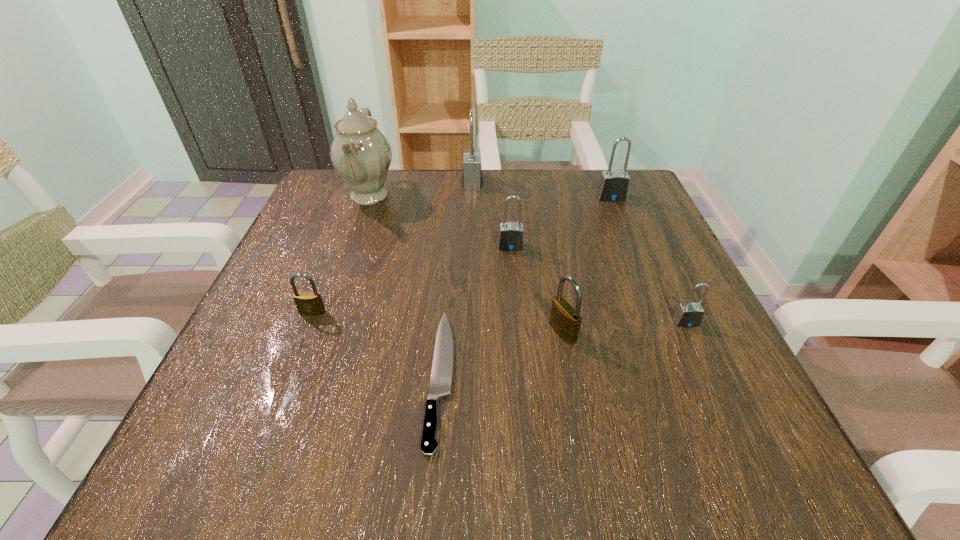
I want to click on the farther brass padlock, so click(308, 303).

Where is `the nearest gray padlock`? This screenshot has width=960, height=540. the nearest gray padlock is located at coordinates tap(688, 315).

What are the coordinates of `steak knife` in the screenshot? It's located at [x=442, y=367].

At what (x,y) coordinates should I click in order to perform the action: click on free spot located on the spout of the tallest object. Please return your answer as a coordinate pair (x, y). Looking at the image, I should click on (451, 195).

Identify the location of vacant area situated on the shackle of the leftmost gray padlock. This screenshot has width=960, height=540. (599, 181).

At what (x,y) coordinates should I click in order to perform the action: click on free location located 0.210m on the shackle of the fifth nearest padlock. Please return your answer as a coordinate pair (x, y). Looking at the image, I should click on (636, 259).

Locate an element on the screen. free space located 0.220m on the shackle of the second gray padlock from left to right is located at coordinates (517, 334).

Find the location of `free space located on the left of the third padlock from right to left`. free space located on the left of the third padlock from right to left is located at coordinates (x=364, y=332).

Find the location of a particular element. The image size is (960, 540). free space located on the right of the smaller brass padlock is located at coordinates (377, 312).

Find the location of a particular element. This screenshot has width=960, height=540. vacant region located 0.130m on the shackle of the smallest gray padlock is located at coordinates (720, 395).